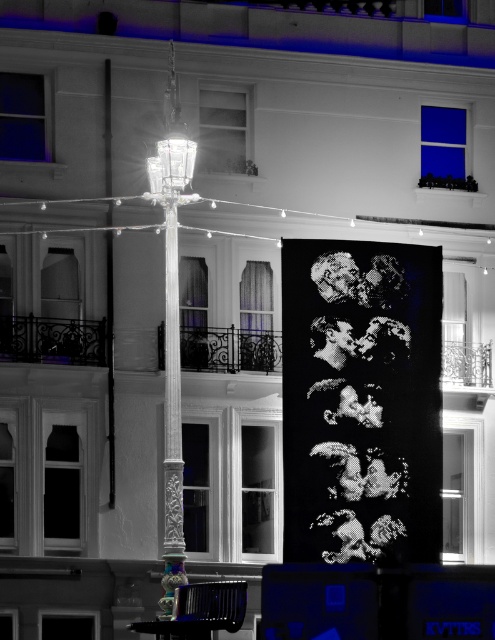
Between point (176, 577) and point (176, 525), which one is positioned behind?

The point (176, 525) is behind.

Is point (176, 326) positioned behind point (179, 516)?

Yes, point (176, 326) is behind point (179, 516).

You are a GUI agent. You are given a task and a screenshot of the screen. Output one action in this format:
    pyautogui.click(x=<x>, y=<y>)
    Task: Click on the white glossy lamp post at center
    The image size is (495, 640).
    Given the screenshot: What is the action you would take?
    pyautogui.click(x=171, y=342)